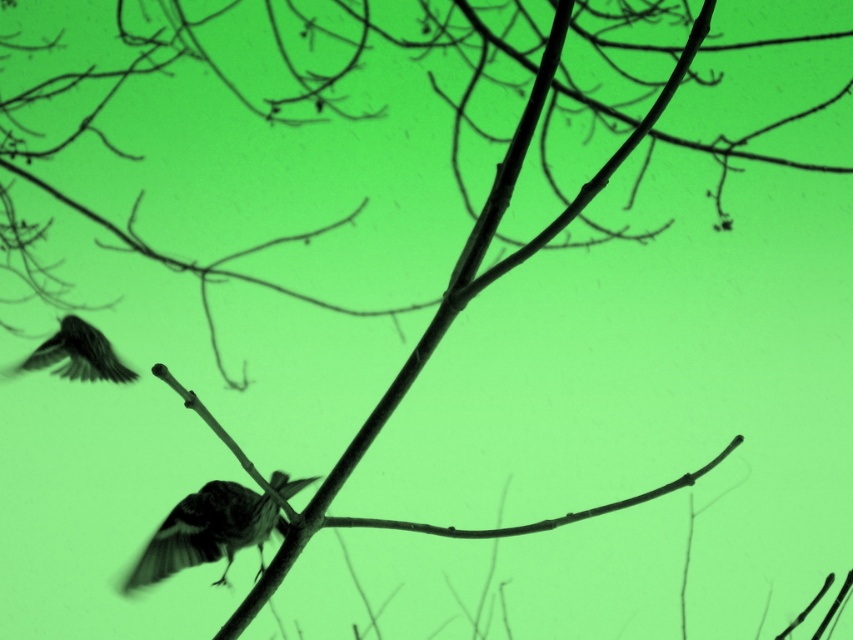
Who is taller, silvery metallic bird at center or silky black feathers at lower left?

Standing taller between the two is silvery metallic bird at center.

Is point (200, 547) in front of point (84, 321)?

Yes.

The image size is (853, 640). I want to click on silvery metallic bird at center, so click(x=207, y=532).